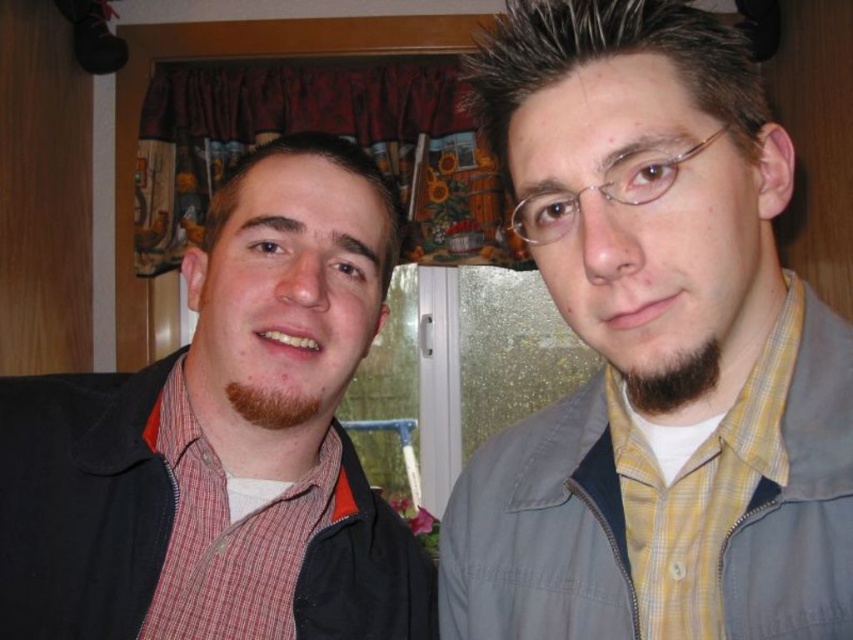
Is matte black jacket at left in front of dark brown fuzzy beard at center?

No, matte black jacket at left is further to the viewer.

Identify the location of matte black jacket at left. Image resolution: width=853 pixels, height=640 pixels. (222, 442).

Where is `matte black jacket at left`? matte black jacket at left is located at coordinates pos(222,442).

Who is more distant from viewer, (614, 115) or (665, 381)?

The point (665, 381) is behind.

Is yellow checkered shirt at center thinner than dark brown fuzzy beard at center?

No.

Is point (598, 419) farther from viewer compared to point (656, 394)?

Yes, it is.

Locate an element on the screen. This screenshot has height=640, width=853. yellow checkered shirt at center is located at coordinates (654, 349).

Who is more distant from viewer, (x=650, y=413) or (x=235, y=401)?

The point (x=235, y=401) is more distant.

Looking at this image, how distant is dark brown fuzzy beard at center from brown fuzzy beard at lower left?

dark brown fuzzy beard at center is 10.55 inches from brown fuzzy beard at lower left.

This screenshot has width=853, height=640. Identify the location of dark brown fuzzy beard at center. (674, 381).